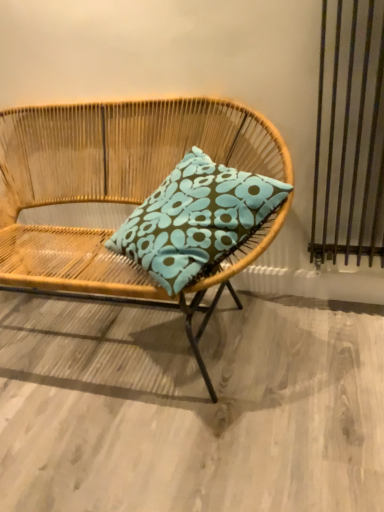
In order to click on free point below woven wood chair at center (from a real-world perspective) in this screenshot , I will do `click(122, 336)`.